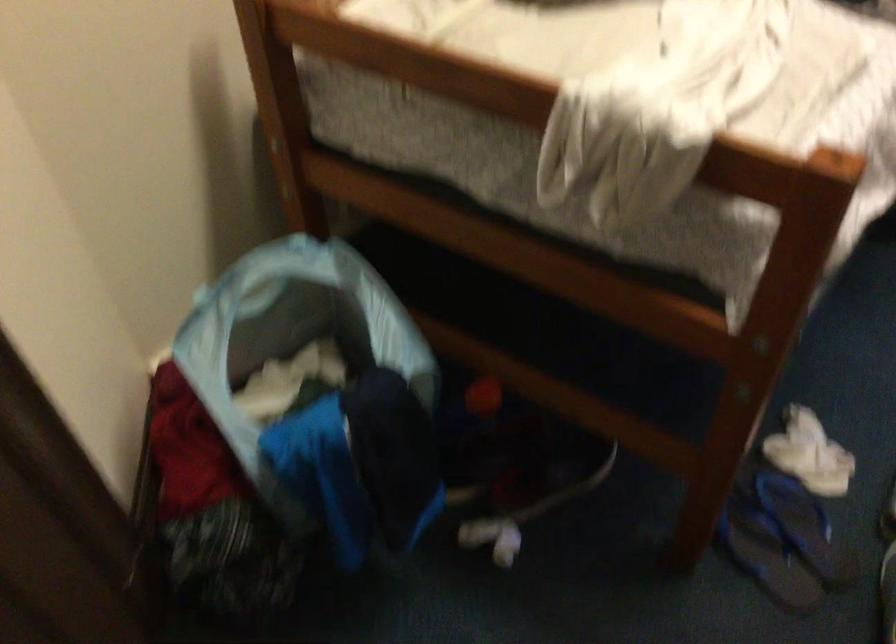
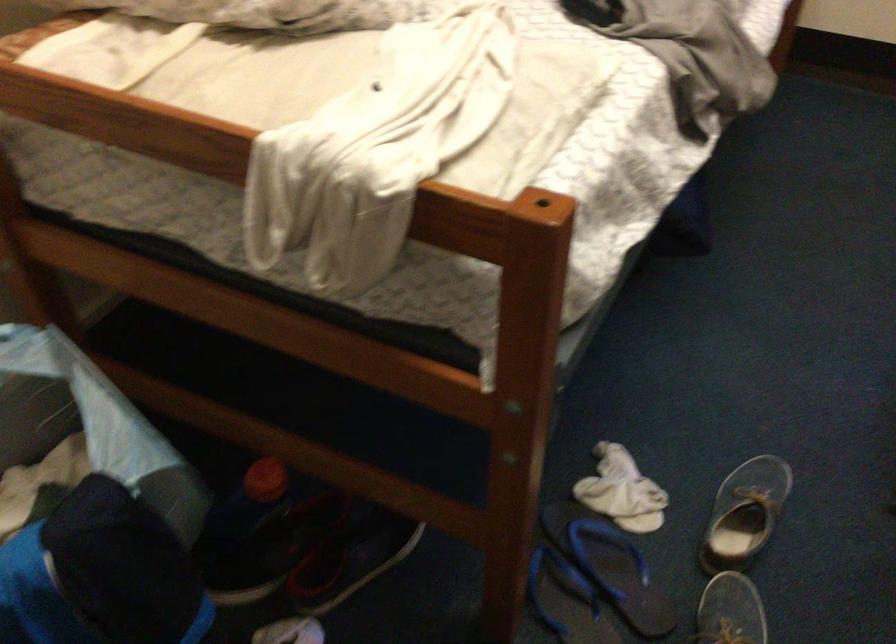
Find the pixel in the second image that matches the point at 746,547 in the first image.

(566, 600)